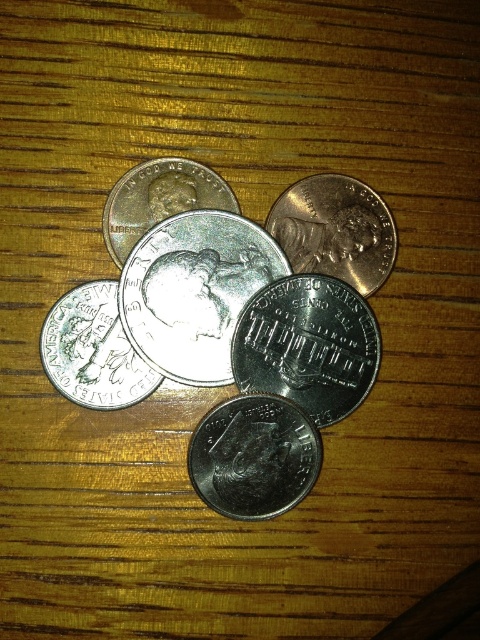
Question: Which object is farther from the camera taking this photo?

Choices:
 (A) silver/metallic coin at center-left
 (B) shiny copper coin at upper center
 (C) silver/metallic coin at upper center

Answer: (B)

Question: Can you confirm if silver/metallic coin at center is positioned below silver/metallic coin at center-left?

Choices:
 (A) no
 (B) yes

Answer: (A)

Question: Which of the following is the farthest from the observer?

Choices:
 (A) (132, 321)
 (B) (362, 268)

Answer: (B)

Question: Does silver metallic coin at center appear on the left side of shiny copper coin at upper center?

Choices:
 (A) yes
 (B) no

Answer: (A)

Question: Which point is farther to the camera?

Choices:
 (A) shiny silver coin at center
 (B) silver/metallic coin at center
 (C) shiny copper coin at upper center
 (D) silver/metallic coin at upper center

Answer: (C)

Question: Can you confirm if shiny copper coin at upper center is positioned above silver/metallic coin at center-left?

Choices:
 (A) yes
 (B) no

Answer: (A)